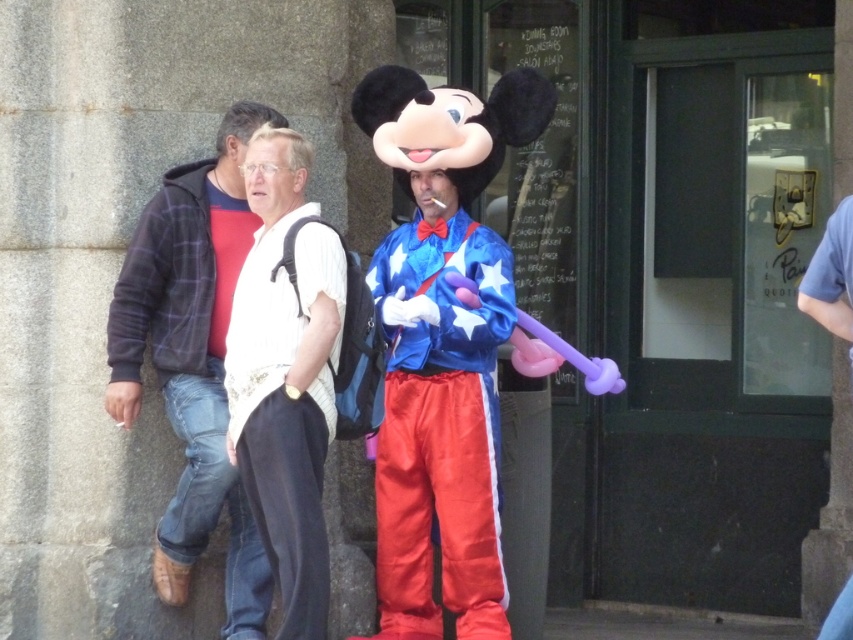
You are a costume designer observing the scene. You need to determine which object is bigger between the shiny blue fabric at center and the velvet blue costume at center. Which one is larger?

The shiny blue fabric at center is larger than the velvet blue costume at center according to the description.